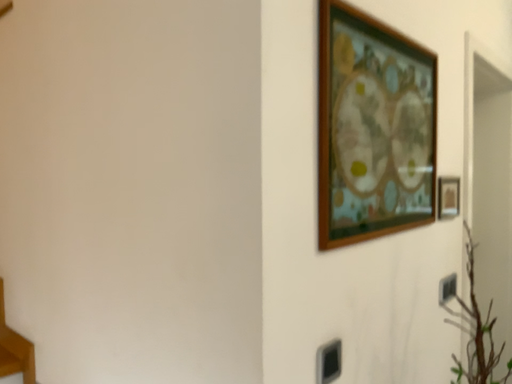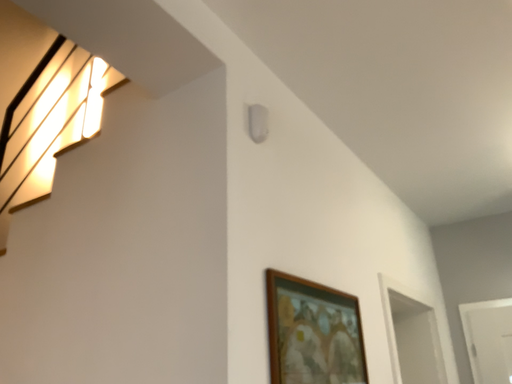
Question: How did the camera likely rotate when shooting the video?

Choices:
 (A) rotated right
 (B) rotated left

Answer: (A)